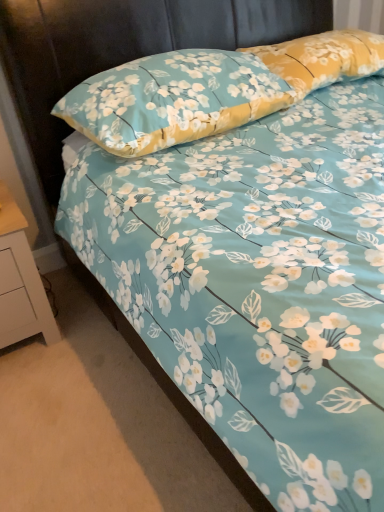
Question: Does yellow floral pillow at upper right, which is the 1th pillow in right-to-left order, have a greater width compared to white painted wood nightstand at lower left?

Choices:
 (A) no
 (B) yes

Answer: (A)

Question: Is yellow floral pillow at upper right, which is counted as the 2th pillow, starting from the left, taller than white painted wood nightstand at lower left?

Choices:
 (A) no
 (B) yes

Answer: (A)

Question: From the image's perspective, is yellow floral pillow at upper right, which is the 1th pillow in right-to-left order, under white painted wood nightstand at lower left?

Choices:
 (A) no
 (B) yes

Answer: (A)

Question: Can you confirm if yellow floral pillow at upper right, which is counted as the 2th pillow, starting from the left, is positioned to the right of white painted wood nightstand at lower left?

Choices:
 (A) no
 (B) yes

Answer: (B)

Question: From the image's perspective, would you say yellow floral pillow at upper right, which is counted as the 2th pillow, starting from the left, is positioned over white painted wood nightstand at lower left?

Choices:
 (A) yes
 (B) no

Answer: (A)

Question: In terms of height, does yellow floral pillow at upper right, which is counted as the 2th pillow, starting from the left, look taller or shorter compared to floral fabric pillow at upper center, the second pillow positioned from the right?

Choices:
 (A) short
 (B) tall

Answer: (A)

Question: Is point (327, 70) positioned closer to the camera than point (187, 103)?

Choices:
 (A) closer
 (B) farther

Answer: (B)

Question: Based on their positions, is yellow floral pillow at upper right, which is the 1th pillow in right-to-left order, located to the left or right of floral fabric pillow at upper center, the first pillow from the left?

Choices:
 (A) right
 (B) left

Answer: (A)

Question: Relative to floral fabric pillow at upper center, the second pillow positioned from the right, is yellow floral pillow at upper right, which is the 1th pillow in right-to-left order, in front or behind?

Choices:
 (A) front
 (B) behind

Answer: (B)

Question: In the image, is white painted wood nightstand at lower left positioned in front of or behind floral fabric pillow at upper center, the second pillow positioned from the right?

Choices:
 (A) front
 (B) behind

Answer: (B)

Question: From their relative heights in the image, would you say white painted wood nightstand at lower left is taller or shorter than floral fabric pillow at upper center, the second pillow positioned from the right?

Choices:
 (A) short
 (B) tall

Answer: (B)

Question: Is white painted wood nightstand at lower left inside the boundaries of floral fabric pillow at upper center, the first pillow from the left, or outside?

Choices:
 (A) inside
 (B) outside

Answer: (B)

Question: In terms of width, does white painted wood nightstand at lower left look wider or thinner when compared to floral fabric pillow at upper center, the second pillow positioned from the right?

Choices:
 (A) wide
 (B) thin

Answer: (B)

Question: Considering their positions, is yellow floral pillow at upper right, which is the 1th pillow in right-to-left order, located in front of or behind white painted wood nightstand at lower left?

Choices:
 (A) behind
 (B) front

Answer: (A)

Question: Looking at their shapes, would you say yellow floral pillow at upper right, which is the 1th pillow in right-to-left order, is wider or thinner than white painted wood nightstand at lower left?

Choices:
 (A) wide
 (B) thin

Answer: (B)